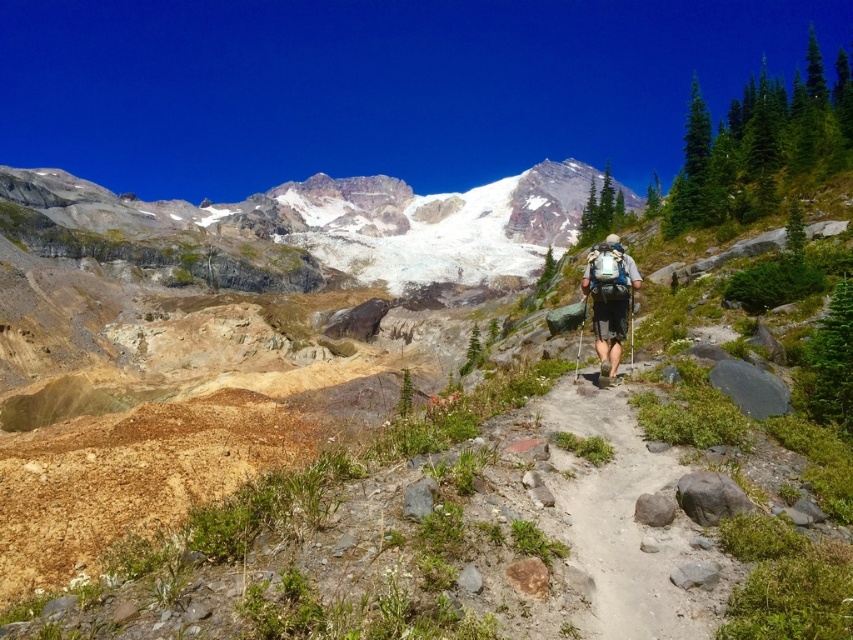
Question: Does snowy granite mountain at center have a larger size compared to dirt path at center?

Choices:
 (A) no
 (B) yes

Answer: (B)

Question: Considering the real-world distances, which object is closest to the dirt path at center?

Choices:
 (A) snowy granite mountain at center
 (B) matte green backpack at center

Answer: (B)

Question: Can you confirm if snowy granite mountain at center is positioned to the right of dirt path at center?

Choices:
 (A) yes
 (B) no

Answer: (B)

Question: Which point is closer to the camera?

Choices:
 (A) (601, 241)
 (B) (575, 227)

Answer: (A)

Question: Among these objects, which one is nearest to the camera?

Choices:
 (A) matte green backpack at center
 (B) dirt path at center
 (C) snowy granite mountain at center

Answer: (B)

Question: Is snowy granite mountain at center wider than matte green backpack at center?

Choices:
 (A) no
 (B) yes

Answer: (B)